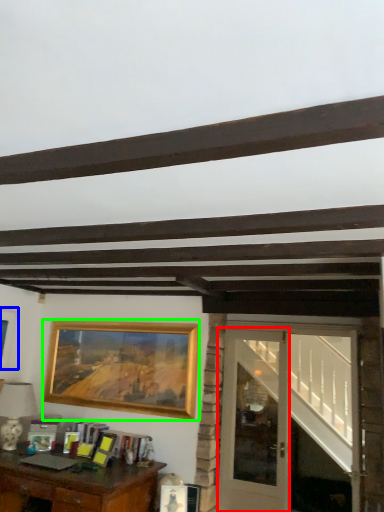
Question: Based on their relative distances, which object is farther from glass door (highlighted by a red box)? Choose from picture frame (highlighted by a blue box) and picture frame (highlighted by a green box).

Choices:
 (A) picture frame
 (B) picture frame

Answer: (A)